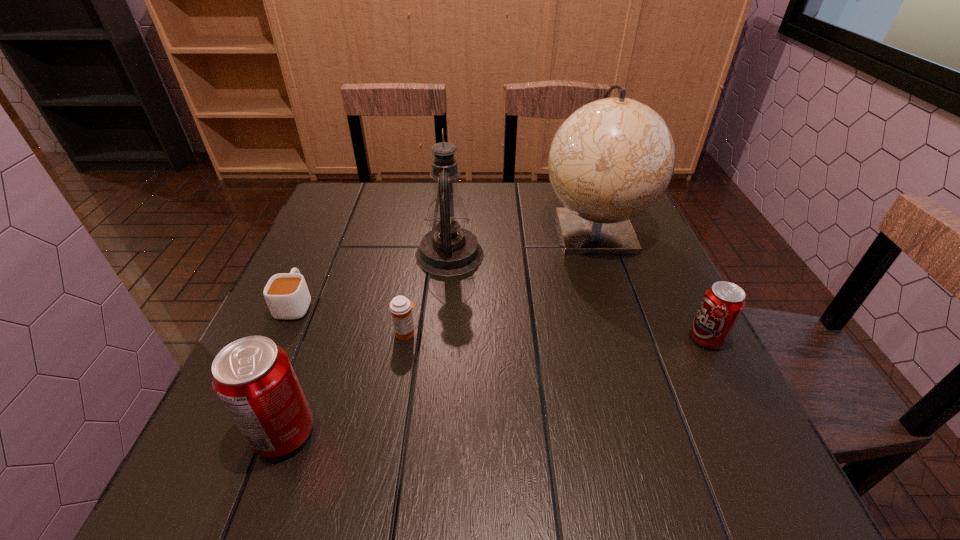
Identify the location of the nearer soda. (253, 378).

This screenshot has height=540, width=960. Find the location of `the taller soda`. the taller soda is located at coordinates (253, 378).

Identify the location of the third shortest object. The height and width of the screenshot is (540, 960). (722, 304).

Locate an element on the screen. The image size is (960, 540). the farther soda is located at coordinates (722, 304).

Locate an element on the screen. oil lamp is located at coordinates (449, 250).

I want to click on globe, so click(x=612, y=159).

Where is `cup`? The image size is (960, 540). cup is located at coordinates (287, 296).

You are a GUI agent. You are given a task and a screenshot of the screen. Output one action in this format:
    pyautogui.click(x=<x>, y=<y>)
    Task: Click on the fourth nearest object
    This screenshot has height=540, width=960.
    Given the screenshot: What is the action you would take?
    pyautogui.click(x=287, y=296)

Image resolution: width=960 pixels, height=540 pixels. Identify the location of medicine. (400, 307).

Where is `blank space located on the right of the nearest object`? Image resolution: width=960 pixels, height=540 pixels. blank space located on the right of the nearest object is located at coordinates (476, 433).